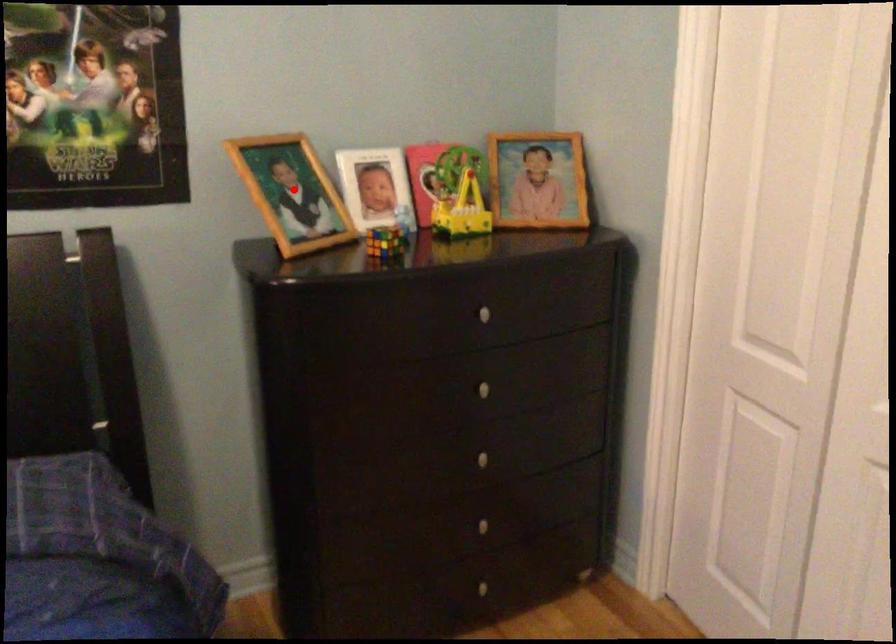
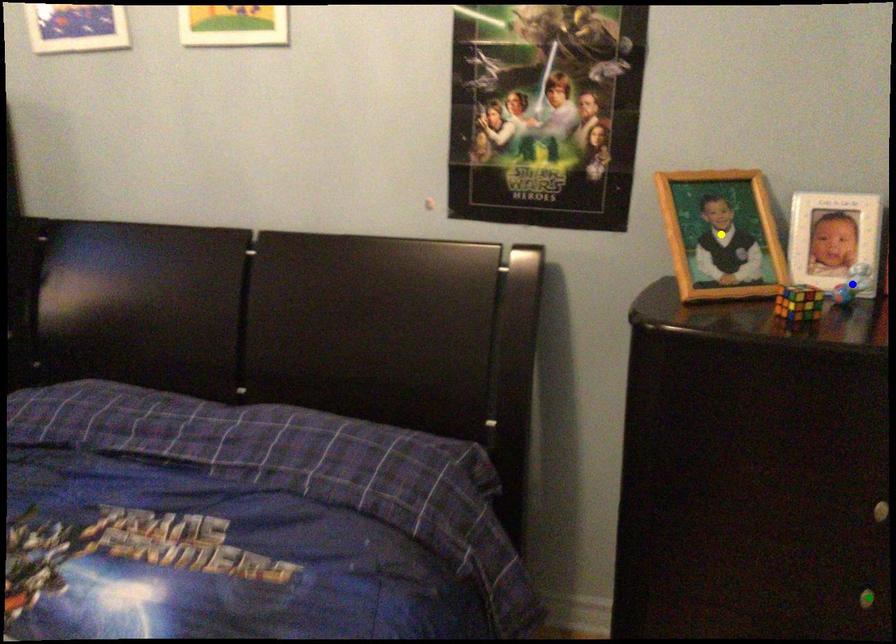
Question: I am providing you with two images of the same scene from different viewpoints. A red point is marked on the first image. You are given multiple points on the second image. Can you choose the point in image 2 that corresponds to the point in image 1?

Choices:
 (A) green point
 (B) blue point
 (C) yellow point

Answer: (C)